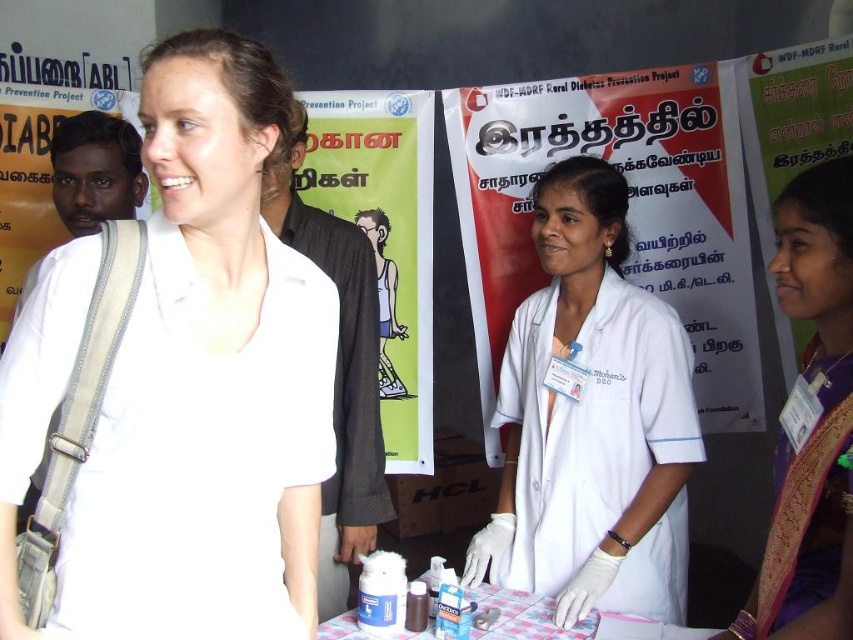
You are a photographer standing 1.5 meters away from the table in the scene. You want to take a closeup photo of the point at coordinates point (193, 605). Can you reach it without moving your position?

The distance of point (193, 605) from camera is 1.06 meters, so yes, you can reach it without moving since you are 1.5 meters away and the point is closer than your current distance.

You are a participant at this health event and want to reach the table where the medical staff are standing. You are currently at the point marked as point (398, 636). The table is 5.06 feet away from you. Can you safely walk to the table without any obstacles?

Yes, you can safely walk to the table since there are no obstacles mentioned in the scene description between point 0.998 and the table located 5.06 feet away.